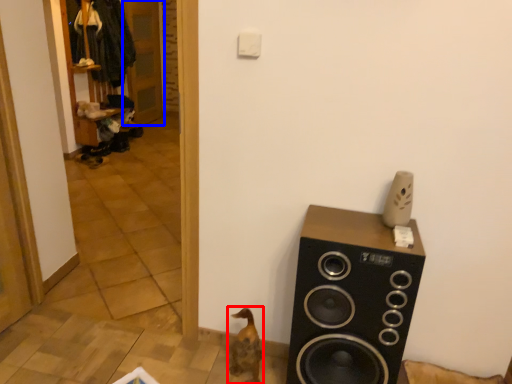
Question: Which object appears farthest to the camera in this image, animal (highlighted by a red box) or door (highlighted by a blue box)?

Choices:
 (A) animal
 (B) door

Answer: (B)